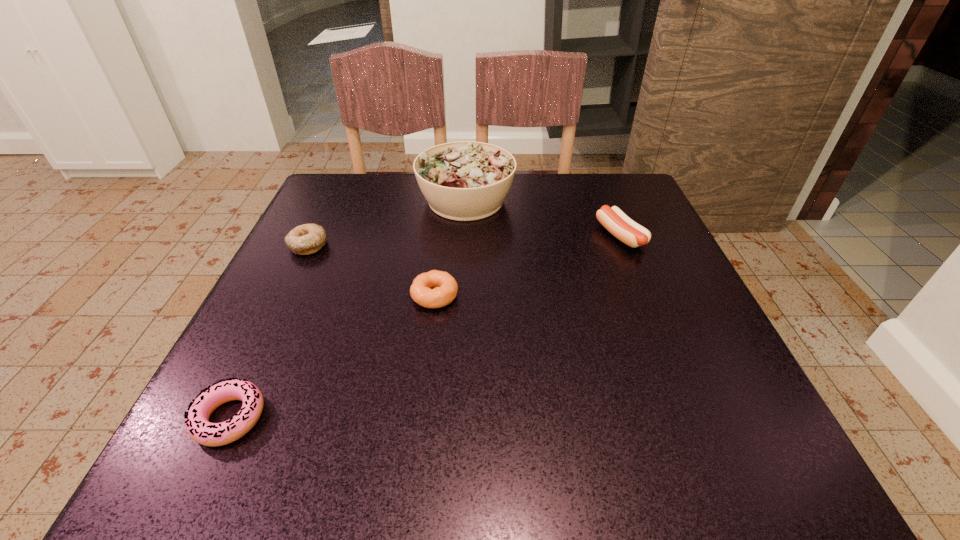
Find the location of a particular element. Image resolution: width=960 pixels, height=540 pixels. vacant region located 0.190m on the back of the nearest object is located at coordinates (285, 302).

You are a GUI agent. You are given a task and a screenshot of the screen. Output one action in this format:
    pyautogui.click(x=<x>, y=<y>)
    Task: Click on the salad at the far edge
    
    Given the screenshot: What is the action you would take?
    pyautogui.click(x=465, y=180)

Locate an element on the screen. The height and width of the screenshot is (540, 960). sausage that is at the far edge is located at coordinates [629, 232].

Identify the location of object located in the near edge section of the desktop. Image resolution: width=960 pixels, height=540 pixels. (198, 426).

Identify the location of object at the right edge. The height and width of the screenshot is (540, 960). (629, 232).

The height and width of the screenshot is (540, 960). Identify the location of object at the near left corner. (198, 426).

The width and height of the screenshot is (960, 540). I want to click on object that is at the far right corner, so click(629, 232).

Locate an element on the screen. This screenshot has width=960, height=540. vacant space at the far edge of the desktop is located at coordinates (415, 185).

Where is `vacant region at the left edge`? vacant region at the left edge is located at coordinates (357, 248).

Where is `vacant space at the right edge of the desktop`? The width and height of the screenshot is (960, 540). vacant space at the right edge of the desktop is located at coordinates (660, 253).